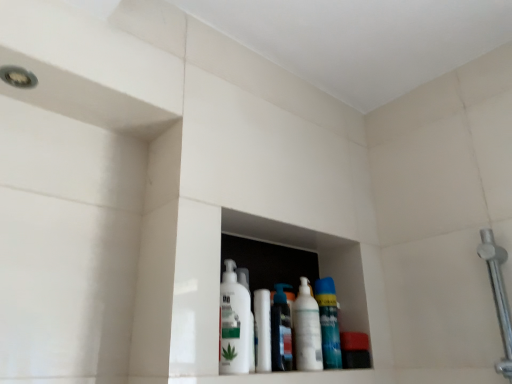
Question: Is polished chrome shower arm at right completely or partially inside translucent plastic spray can at center, which is counted as the second cleaning product, starting from the left?

Choices:
 (A) no
 (B) yes

Answer: (A)

Question: Is translucent plastic spray can at center, arranged as the 3th cleaning product when viewed from the right, turned away from polished chrome shower arm at right?

Choices:
 (A) no
 (B) yes

Answer: (A)

Question: Can you confirm if translucent plastic spray can at center, arranged as the 3th cleaning product when viewed from the right, is thinner than polished chrome shower arm at right?

Choices:
 (A) no
 (B) yes

Answer: (B)

Question: Can you confirm if translucent plastic spray can at center, which is counted as the second cleaning product, starting from the left, is positioned to the right of polished chrome shower arm at right?

Choices:
 (A) no
 (B) yes

Answer: (A)

Question: Does translucent plastic spray can at center, arranged as the 3th cleaning product when viewed from the right, have a lesser height compared to polished chrome shower arm at right?

Choices:
 (A) no
 (B) yes

Answer: (B)

Question: Visually, is polished chrome shower arm at right positioned to the left or to the right of white glossy mouthwash at center?

Choices:
 (A) left
 (B) right

Answer: (B)

Question: In terms of height, does polished chrome shower arm at right look taller or shorter compared to white glossy mouthwash at center?

Choices:
 (A) tall
 (B) short

Answer: (A)

Question: Based on their sizes in the image, would you say polished chrome shower arm at right is bigger or smaller than white glossy mouthwash at center?

Choices:
 (A) small
 (B) big

Answer: (B)

Question: From a real-world perspective, is polished chrome shower arm at right physically located above or below white glossy mouthwash at center?

Choices:
 (A) below
 (B) above

Answer: (B)

Question: From a real-world perspective, relative to white glossy lotion at center, marked as the first cleaning product in a left-to-right arrangement, is white glossy bottle at center, which is counted as the 2th cleaning product, starting from the right, vertically above or below?

Choices:
 (A) below
 (B) above

Answer: (A)

Question: Is white glossy bottle at center, which ranks as the third cleaning product in left-to-right order, inside the boundaries of white glossy lotion at center, which appears as the 4th cleaning product when viewed from the right, or outside?

Choices:
 (A) outside
 (B) inside

Answer: (A)

Question: Is point tap(308, 340) closer or farther from the camera than point tap(238, 327)?

Choices:
 (A) closer
 (B) farther

Answer: (B)

Question: From the image's perspective, is white glossy bottle at center, which ranks as the third cleaning product in left-to-right order, positioned above or below white glossy lotion at center, which appears as the 4th cleaning product when viewed from the right?

Choices:
 (A) above
 (B) below

Answer: (B)

Question: Is translucent plastic spray can at center, which is counted as the second cleaning product, starting from the left, inside or outside of white glossy mouthwash at center?

Choices:
 (A) outside
 (B) inside

Answer: (A)

Question: Is point (270, 345) closer or farther from the camera than point (266, 296)?

Choices:
 (A) closer
 (B) farther

Answer: (A)